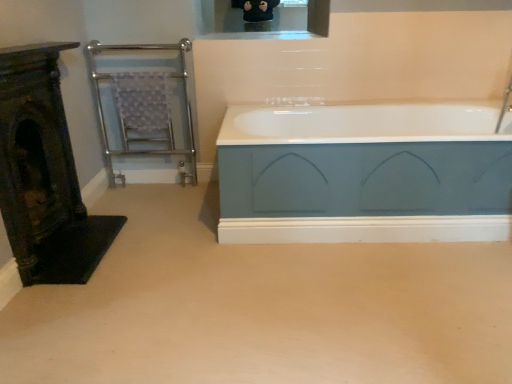
Identify the location of vacant location below chrome/metallic towel rail at left (from a real-world perspective). The height and width of the screenshot is (384, 512). (153, 177).